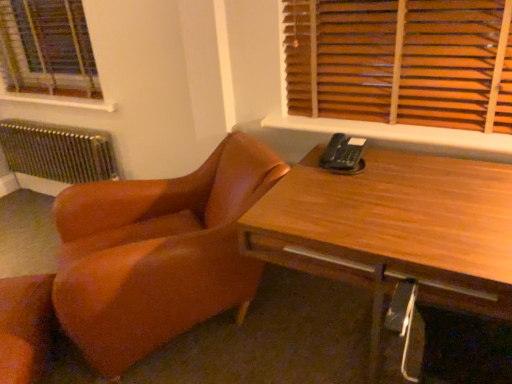
Question: From a real-world perspective, relative to wooden blinds at upper left, is wooden blinds at upper right vertically above or below?

Choices:
 (A) above
 (B) below

Answer: (B)

Question: Considering their positions, is wooden blinds at upper right located in front of or behind wooden blinds at upper left?

Choices:
 (A) behind
 (B) front

Answer: (B)

Question: Which object is positioned farthest from the brown leather chair at left, the 1th chair from the right?

Choices:
 (A) white wood window sill at upper left, the 1th window sill when ordered from left to right
 (B) wooden blinds at upper left
 (C) wooden desk at center
 (D) wooden at upper right, the 1th window sill ordered from the bottom
 (E) leather at lower left, the second chair from the right

Answer: (B)

Question: Which is farther from the leather at lower left, the second chair from the right?

Choices:
 (A) wooden at upper right, the 1th window sill ordered from the bottom
 (B) brown leather chair at left, positioned as the second chair in left-to-right order
 (C) wooden desk at center
 (D) wooden blinds at upper right
 (E) white wood window sill at upper left, marked as the second window sill in a bottom-to-top arrangement

Answer: (D)